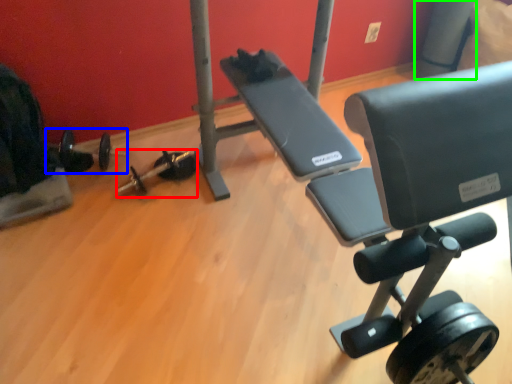
Question: Which is farther away from dumbbell (highlighted by a red box)? barbell (highlighted by a blue box) or pole (highlighted by a green box)?

Choices:
 (A) barbell
 (B) pole

Answer: (B)